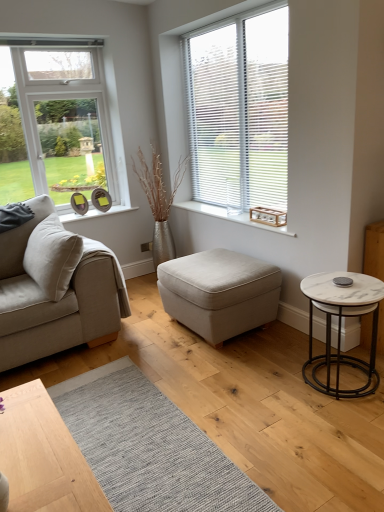
Image resolution: width=384 pixels, height=512 pixels. In order to click on free space in front of white marble side table at right in this screenshot , I will do `click(338, 429)`.